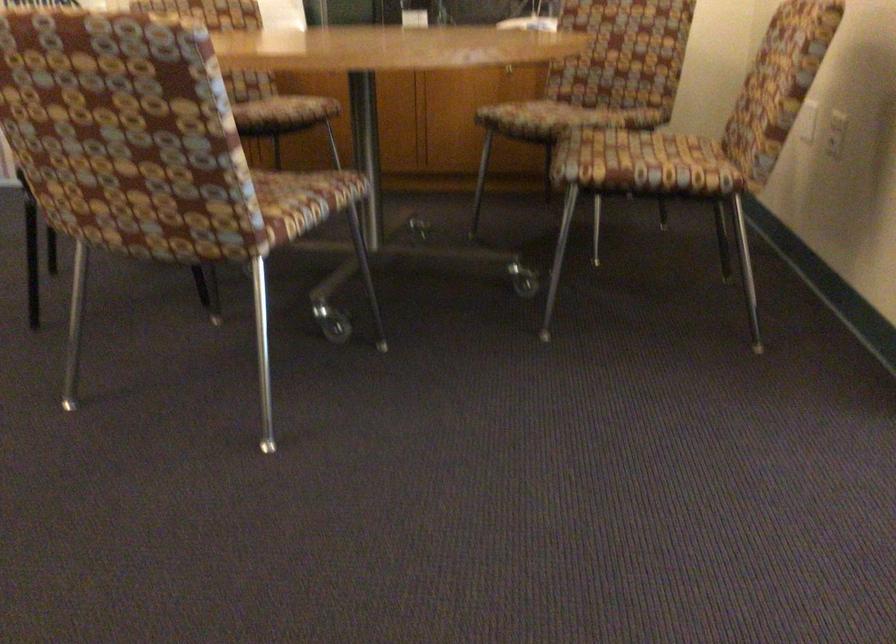
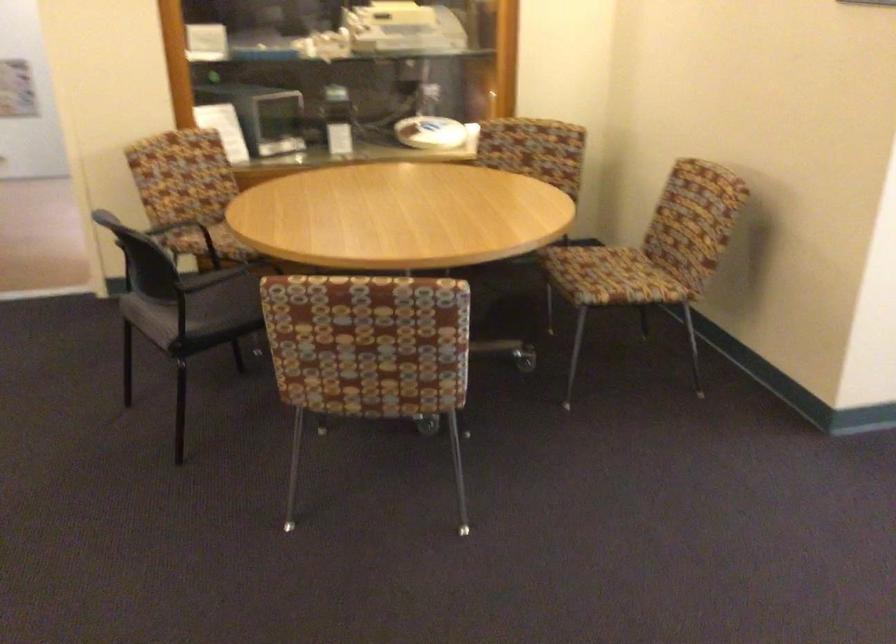
In a continuous first-person perspective shot, in which direction is the camera moving?

The movement direction of the cameraman is left, backward.